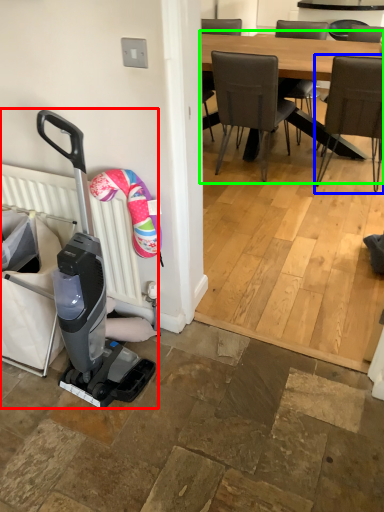
Question: Based on their relative distances, which object is nearer to baby carriage (highlighted by a red box)? Choose from chair (highlighted by a blue box) and kitchen & dining room table (highlighted by a green box).

Choices:
 (A) chair
 (B) kitchen & dining room table

Answer: (A)